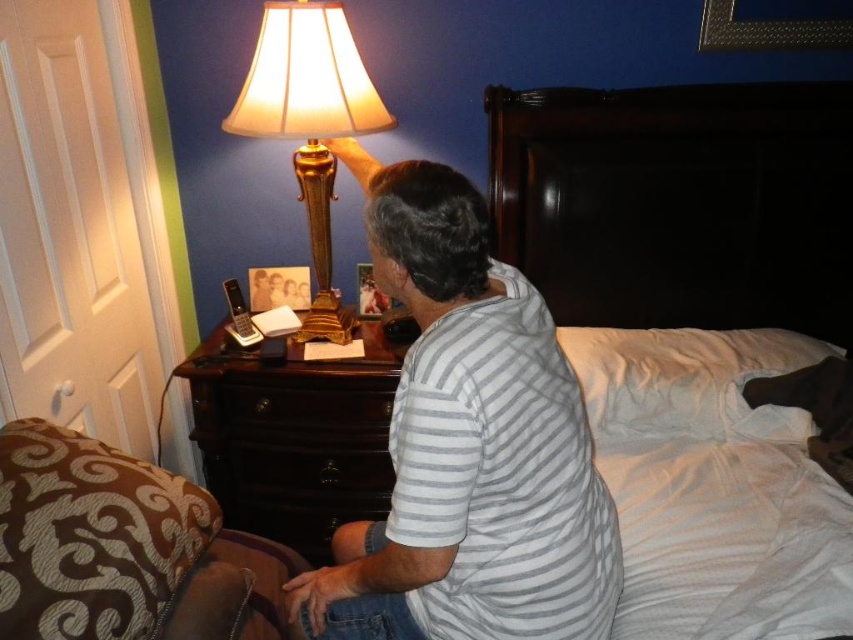
Can you confirm if white soft pillow at upper right is taller than gold metallic lamp at upper left?

In fact, white soft pillow at upper right may be shorter than gold metallic lamp at upper left.

Between white soft pillow at upper right and gold metallic lamp at upper left, which one has more height?

gold metallic lamp at upper left is taller.

Is point (631, 438) closer to camera compared to point (283, 38)?

No, it is behind (283, 38).

At what (x,y) coordinates should I click in order to perform the action: click on white soft pillow at upper right. Please return your answer as a coordinate pair (x, y). The width and height of the screenshot is (853, 640). Looking at the image, I should click on (688, 381).

Does gray striped shirt at center appear over dark wood dresser at lower left?

Indeed, gray striped shirt at center is positioned over dark wood dresser at lower left.

Identify the location of gray striped shirt at center. This screenshot has height=640, width=853. (469, 449).

Can you confirm if brown textured fabric at lower left is positioned to the right of white soft pillow at upper right?

Incorrect, brown textured fabric at lower left is not on the right side of white soft pillow at upper right.

Where is `brown textured fabric at lower left`? The image size is (853, 640). brown textured fabric at lower left is located at coordinates (123, 548).